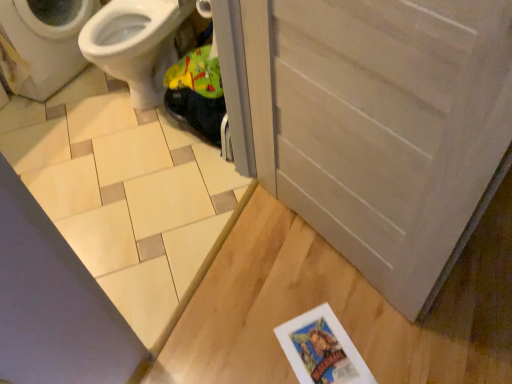
What is the approximate width of white glossy bidet at upper left?

white glossy bidet at upper left is 22.48 inches in width.

At what (x,y) coordinates should I click in order to perform the action: click on white glossy bidet at upper left. Please return your answer as a coordinate pair (x, y). The width and height of the screenshot is (512, 384). Looking at the image, I should click on (136, 44).

Is white glossy bidet at upper left oriented away from white matte screen door at lower right?

No.

Looking at the image, does white glossy bidet at upper left seem bigger or smaller compared to white matte screen door at lower right?

Clearly, white glossy bidet at upper left is larger in size than white matte screen door at lower right.

Could white matte screen door at lower right be considered to be inside white glossy bidet at upper left?

Definitely not — white matte screen door at lower right is not inside white glossy bidet at upper left.

Which is closer, (85, 48) or (141, 211)?

Point (85, 48) appears to be farther away from the viewer than point (141, 211).

Considering the sizes of objects white glossy bidet at upper left and beige ceramic tile at lower left in the image provided, who is bigger, white glossy bidet at upper left or beige ceramic tile at lower left?

Bigger between the two is white glossy bidet at upper left.

Looking at their sizes, would you say white glossy bidet at upper left is wider or thinner than beige ceramic tile at lower left?

Considering their sizes, white glossy bidet at upper left looks slimmer than beige ceramic tile at lower left.

At what (x,y) coordinates should I click in order to perform the action: click on tile lying in front of the white glossy bidet at upper left. Please return your answer as a coordinate pair (x, y). The height and width of the screenshot is (384, 512). Looking at the image, I should click on (123, 193).

Who is shorter, beige ceramic tile at lower left or white glossy bidet at upper left?

beige ceramic tile at lower left is shorter.

From a real-world perspective, is beige ceramic tile at lower left below white glossy bidet at upper left?

Indeed, from a real-world perspective, beige ceramic tile at lower left is positioned beneath white glossy bidet at upper left.

Considering the sizes of beige ceramic tile at lower left and white glossy bidet at upper left in the image, is beige ceramic tile at lower left wider or thinner than white glossy bidet at upper left?

→ beige ceramic tile at lower left is wider than white glossy bidet at upper left.

You are a GUI agent. You are given a task and a screenshot of the screen. Output one action in this format:
    pyautogui.click(x=<x>, y=<y>)
    Task: Click on the bidet that is above the white matte screen door at lower right (from the image's perspective)
    This screenshot has height=384, width=512.
    Given the screenshot: What is the action you would take?
    pyautogui.click(x=136, y=44)

From the picture: Between white matte screen door at lower right and white glossy bidet at upper left, which one has larger size?

white glossy bidet at upper left is bigger.

How different are the orientations of white matte screen door at lower right and white glossy bidet at upper left in degrees?

white matte screen door at lower right and white glossy bidet at upper left are facing 27.5 degrees away from each other.

Considering the sizes of objects white matte screen door at lower right and white glossy bidet at upper left in the image provided, who is wider, white matte screen door at lower right or white glossy bidet at upper left?

white glossy bidet at upper left is wider.

How far apart are white matte screen door at lower right and beige ceramic tile at lower left?

white matte screen door at lower right is 33.55 inches from beige ceramic tile at lower left.

In terms of width, does white matte screen door at lower right look wider or thinner when compared to beige ceramic tile at lower left?

In the image, white matte screen door at lower right appears to be more narrow than beige ceramic tile at lower left.

How different are the orientations of white matte screen door at lower right and beige ceramic tile at lower left in degrees?

There is a 117-degree angle between the facing directions of white matte screen door at lower right and beige ceramic tile at lower left.

Is white matte screen door at lower right spatially inside beige ceramic tile at lower left, or outside of it?

white matte screen door at lower right is outside beige ceramic tile at lower left.

Between beige ceramic tile at lower left and white matte screen door at lower right, which one appears on the left side from the viewer's perspective?

Positioned to the left is beige ceramic tile at lower left.

Is beige ceramic tile at lower left spatially inside white matte screen door at lower right, or outside of it?

beige ceramic tile at lower left cannot be found inside white matte screen door at lower right.

Is point (219, 220) positioned before point (290, 98)?

No.

Identify the location of bidet above the white matte screen door at lower right (from the image's perspective). click(136, 44).

In the image, there is a white glossy bidet at upper left. Where is `tile below it (from a real-world perspective)`? The width and height of the screenshot is (512, 384). tile below it (from a real-world perspective) is located at coordinates (123, 193).

Based on the photo, which object lies further to the anchor point white glossy bidet at upper left, beige ceramic tile at lower left or white matte screen door at lower right?

white matte screen door at lower right.

In the scene shown: Estimate the real-world distances between objects in this image. Which object is further from white glossy bidet at upper left, white matte screen door at lower right or beige ceramic tile at lower left?

white matte screen door at lower right is further to white glossy bidet at upper left.

Consider the image. From the image, which object appears to be farther from beige ceramic tile at lower left, white matte screen door at lower right or white glossy bidet at upper left?

white matte screen door at lower right is further to beige ceramic tile at lower left.

Considering their positions, is white glossy bidet at upper left positioned closer to beige ceramic tile at lower left than white matte screen door at lower right?

white glossy bidet at upper left.

When comparing their distances from white matte screen door at lower right, does beige ceramic tile at lower left or white glossy bidet at upper left seem closer?

beige ceramic tile at lower left lies closer to white matte screen door at lower right than the other object.

Which object lies nearer to the anchor point white matte screen door at lower right, white glossy bidet at upper left or beige ceramic tile at lower left?

The object closer to white matte screen door at lower right is beige ceramic tile at lower left.

At what (x,y) coordinates should I click in order to perform the action: click on tile between white matte screen door at lower right and white glossy bidet at upper left in the front-back direction. Please return your answer as a coordinate pair (x, y). Looking at the image, I should click on (123, 193).